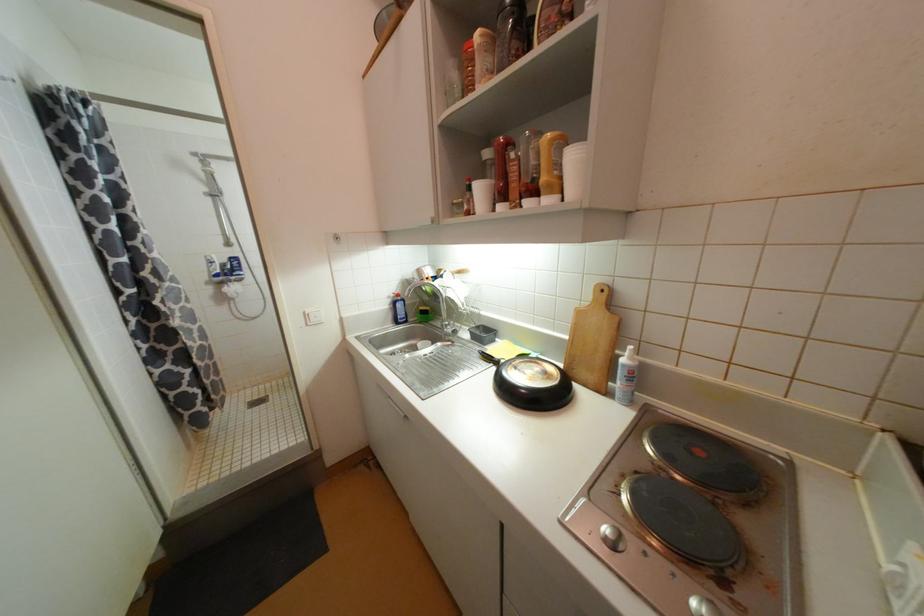
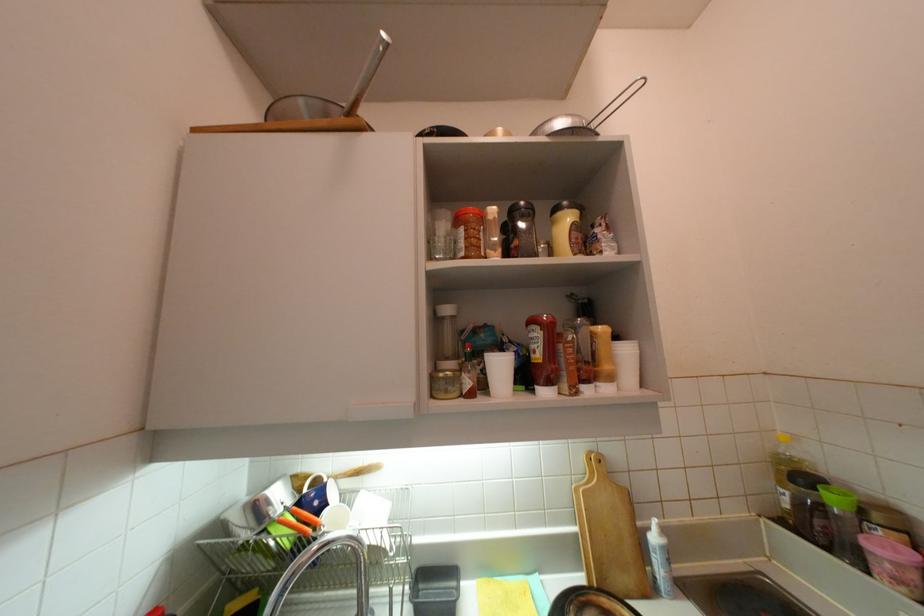
How did the camera likely rotate?

The camera rotated toward right-up.